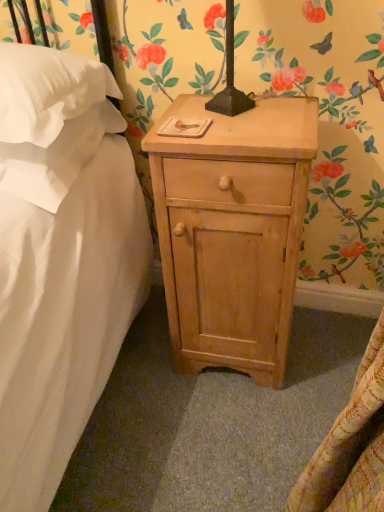
Question: Does white soft pillow at upper left, the second pillow when ordered from top to bottom, have a larger size compared to natural wood nightstand at center?

Choices:
 (A) no
 (B) yes

Answer: (A)

Question: From a real-world perspective, is white soft pillow at upper left, the second pillow when ordered from top to bottom, on top of natural wood nightstand at center?

Choices:
 (A) no
 (B) yes

Answer: (B)

Question: From a real-world perspective, is white soft pillow at upper left, the second pillow when ordered from top to bottom, physically below natural wood nightstand at center?

Choices:
 (A) yes
 (B) no

Answer: (B)

Question: Could you tell me if white soft pillow at upper left, arranged as the first pillow when ordered from the bottom, is facing natural wood nightstand at center?

Choices:
 (A) yes
 (B) no

Answer: (B)

Question: Is white soft pillow at upper left, the second pillow when ordered from top to bottom, closer to the viewer compared to natural wood nightstand at center?

Choices:
 (A) yes
 (B) no

Answer: (B)

Question: Does white soft pillow at upper left, arranged as the first pillow when ordered from the bottom, have a greater width compared to natural wood nightstand at center?

Choices:
 (A) yes
 (B) no

Answer: (A)

Question: Is natural wood nightstand at center turned away from white soft pillow at upper left, the first pillow viewed from the top?

Choices:
 (A) no
 (B) yes

Answer: (A)

Question: Considering the relative positions of natural wood nightstand at center and white soft pillow at upper left, which is counted as the second pillow, starting from the bottom, in the image provided, is natural wood nightstand at center to the left of white soft pillow at upper left, which is counted as the second pillow, starting from the bottom, from the viewer's perspective?

Choices:
 (A) yes
 (B) no

Answer: (B)

Question: From a real-world perspective, is natural wood nightstand at center positioned under white soft pillow at upper left, which is counted as the second pillow, starting from the bottom, based on gravity?

Choices:
 (A) yes
 (B) no

Answer: (A)

Question: From the image's perspective, is natural wood nightstand at center over white soft pillow at upper left, the first pillow viewed from the top?

Choices:
 (A) no
 (B) yes

Answer: (A)

Question: Does natural wood nightstand at center appear on the right side of white soft pillow at upper left, which is counted as the second pillow, starting from the bottom?

Choices:
 (A) no
 (B) yes

Answer: (B)

Question: From the image's perspective, is natural wood nightstand at center below white soft pillow at upper left, which is counted as the second pillow, starting from the bottom?

Choices:
 (A) no
 (B) yes

Answer: (B)

Question: Considering the relative positions of white soft pillow at upper left, the first pillow viewed from the top, and natural wood nightstand at center in the image provided, is white soft pillow at upper left, the first pillow viewed from the top, behind natural wood nightstand at center?

Choices:
 (A) no
 (B) yes

Answer: (A)